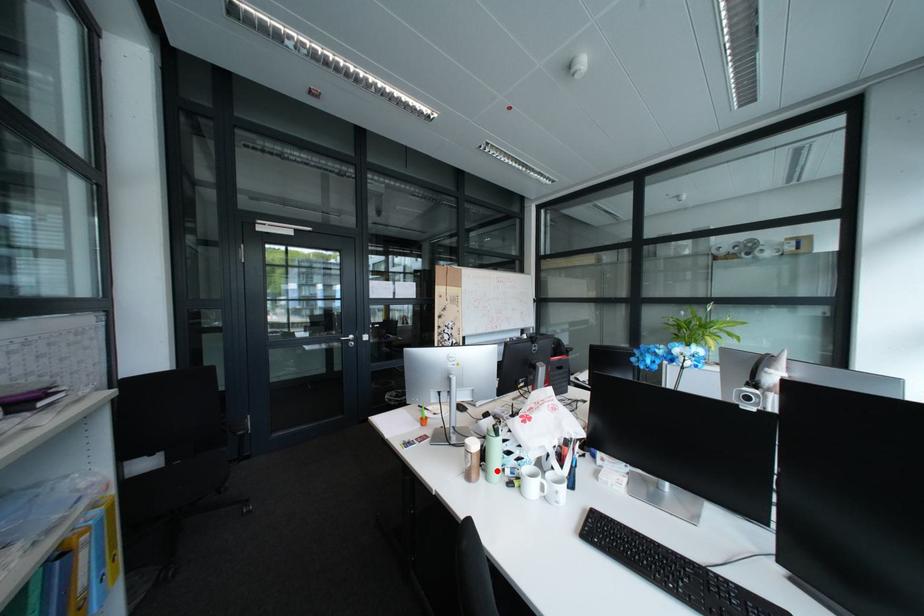
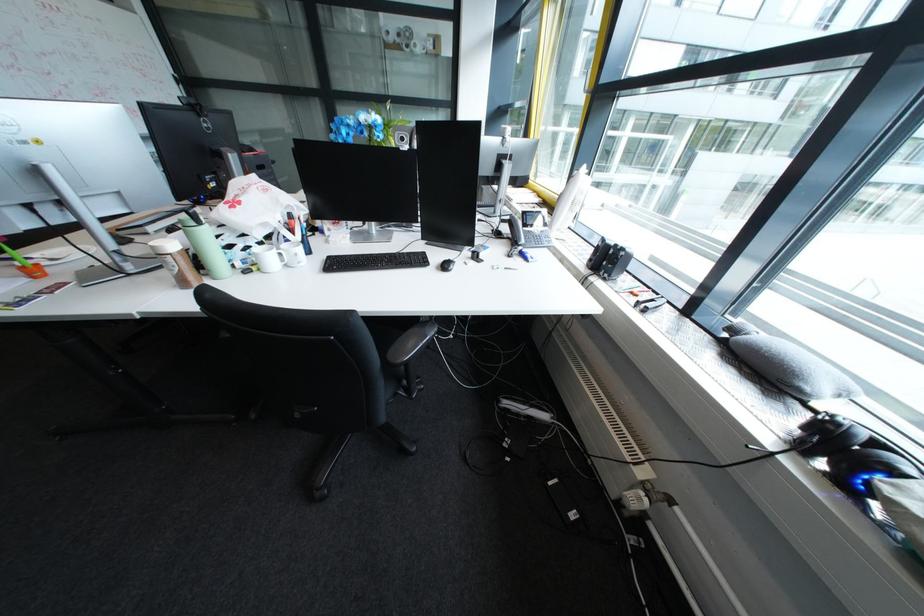
Question: I am providing you with two images of the same scene from different viewpoints. A red point is marked on the first image. Is the red point's position out of view in image 2?

Choices:
 (A) Yes
 (B) No

Answer: (B)